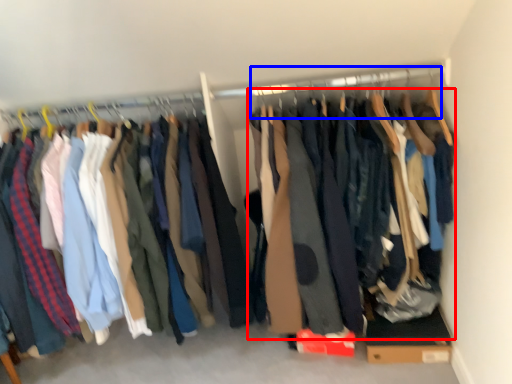
Question: Which point is closer to the camera, clothing (highlighted by a red box) or hanger (highlighted by a blue box)?

Choices:
 (A) clothing
 (B) hanger

Answer: (A)